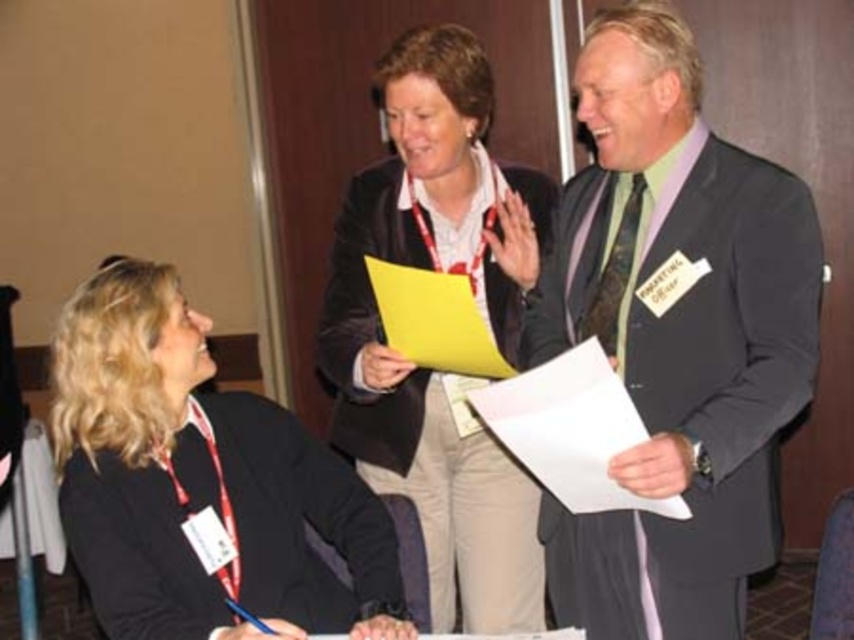
You are standing at point [431,68] and want to walk to point [632,636]. Is the destination point in front of you or behind you?

The destination point [632,636] is in front of point [431,68], so the destination is in front of you.

You are organizing a charity event and need to decide which jacket to wear based on the image. The dark gray suit at center and the black matte jacket at lower left are both available. Which one is more suitable if you want a slimmer silhouette?

The dark gray suit at center is thinner than the black matte jacket at lower left, so it would provide a slimmer silhouette and is more suitable for the charity event.